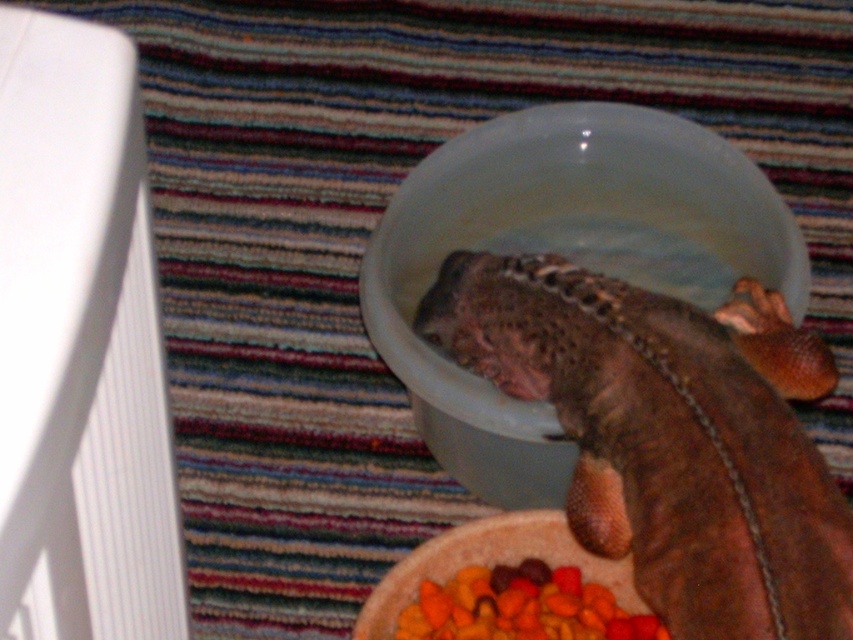
You are a pet owner who wants to place a decorative item in the bowl with the brown scaly lizard at center. Considering the size of the translucent plastic bowl at center, can you fit a small rock that is 3 cm in diameter into the bowl without overcrowding it?

The brown scaly lizard at center is thinner than the translucent plastic bowl at center, which suggests the bowl has enough space. A 3 cm rock should fit without overcrowding.

You are a pet owner who wants to ensure the brown scaly lizard at center has enough space to move around in the translucent plastic bowl at center. Based on their sizes, do you think the lizard has enough room?

The brown scaly lizard at center has a smaller size compared to the translucent plastic bowl at center, so it likely has enough space to move around comfortably.

You are standing in the room where the axolotl is kept. There is a point marked at coordinates (566, 256). What object is located at that point?

The point at coordinates (566, 256) marks the translucent plastic bowl at center.